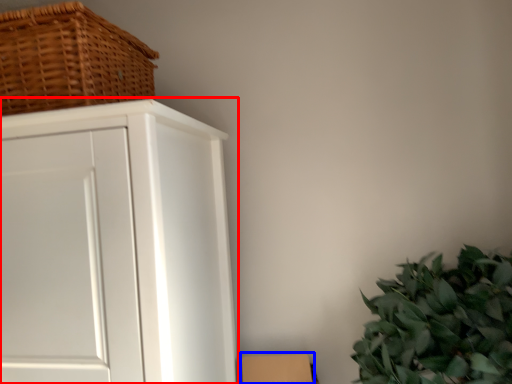
Question: Which object is further to the camera taking this photo, cupboard (highlighted by a red box) or cardboard box (highlighted by a blue box)?

Choices:
 (A) cupboard
 (B) cardboard box

Answer: (B)